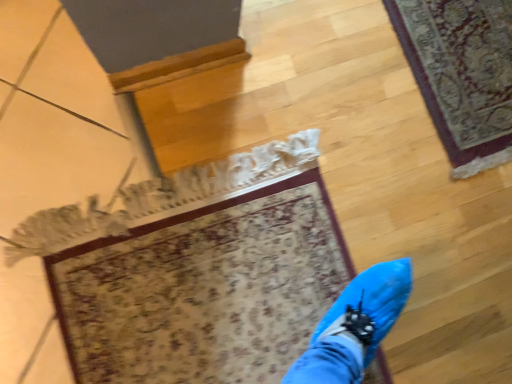
Locate an element on the screen. Image resolution: width=512 pixels, height=384 pixels. beige textured rug at lower left is located at coordinates (204, 290).

Describe the element at coordinates (204, 290) in the screenshot. Image resolution: width=512 pixels, height=384 pixels. I see `beige textured rug at lower left` at that location.

Where is `beige textured rug at lower left`? The image size is (512, 384). beige textured rug at lower left is located at coordinates (204, 290).